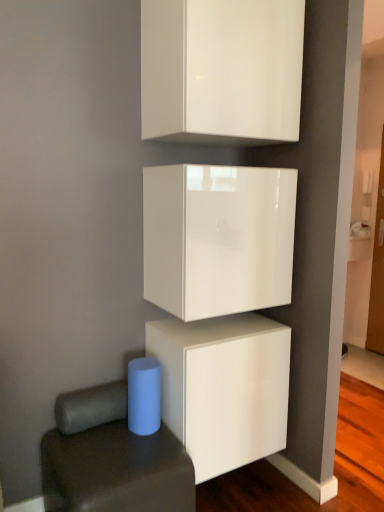
The height and width of the screenshot is (512, 384). Describe the element at coordinates (221, 70) in the screenshot. I see `white glossy cabinet at upper center, which is the first cabinetry in top-to-bottom order` at that location.

What is the approximate width of blue matte cylinder at lower left?

blue matte cylinder at lower left is 22.90 inches wide.

What are the coordinates of `white glossy cabinet at upper center, which is the first cabinetry in top-to-bottom order` in the screenshot? It's located at (221, 70).

Who is smaller, white glossy cabinet at lower center, the third cabinetry in the top-to-bottom sequence, or blue matte cylinder at lower left?

blue matte cylinder at lower left.

Considering the sizes of objects white glossy cabinet at lower center, the 1th cabinetry positioned from the bottom, and blue matte cylinder at lower left in the image provided, who is shorter, white glossy cabinet at lower center, the 1th cabinetry positioned from the bottom, or blue matte cylinder at lower left?

Standing shorter between the two is blue matte cylinder at lower left.

Could you tell me if white glossy cabinet at lower center, the third cabinetry in the top-to-bottom sequence, is turned towards blue matte cylinder at lower left?

No, white glossy cabinet at lower center, the third cabinetry in the top-to-bottom sequence, is not turned towards blue matte cylinder at lower left.

Is white glossy cabinet at lower center, the 1th cabinetry positioned from the bottom, behind blue matte cylinder at lower left?

Yes, the depth of white glossy cabinet at lower center, the 1th cabinetry positioned from the bottom, is greater than that of blue matte cylinder at lower left.

From the image's perspective, is white glossy cabinet at lower center, the 1th cabinetry positioned from the bottom, positioned above or below glossy white cube at center, the second cabinetry from the top?

white glossy cabinet at lower center, the 1th cabinetry positioned from the bottom, is below glossy white cube at center, the second cabinetry from the top.

Which is more to the left, white glossy cabinet at lower center, the third cabinetry in the top-to-bottom sequence, or glossy white cube at center, the second cabinetry when ordered from bottom to top?

Positioned to the left is white glossy cabinet at lower center, the third cabinetry in the top-to-bottom sequence.

Is point (236, 416) less distant than point (226, 251)?

No, (236, 416) is behind (226, 251).

Is there a large distance between white glossy cabinet at lower center, the third cabinetry in the top-to-bottom sequence, and glossy white cube at center, the second cabinetry from the top?

No, white glossy cabinet at lower center, the third cabinetry in the top-to-bottom sequence, is not far away from glossy white cube at center, the second cabinetry from the top.

From the image's perspective, would you say glossy white cube at center, the second cabinetry from the top, is positioned over white glossy cabinet at upper center, which is the first cabinetry in top-to-bottom order?

No, from the image's perspective, glossy white cube at center, the second cabinetry from the top, is not on top of white glossy cabinet at upper center, which is the first cabinetry in top-to-bottom order.

Is glossy white cube at center, the second cabinetry when ordered from bottom to top, positioned behind white glossy cabinet at upper center, the third cabinetry from the bottom?

Yes, glossy white cube at center, the second cabinetry when ordered from bottom to top, is further from the viewer.

From a real-world perspective, between glossy white cube at center, the second cabinetry when ordered from bottom to top, and white glossy cabinet at upper center, the third cabinetry from the bottom, who is vertically higher?

white glossy cabinet at upper center, the third cabinetry from the bottom, is physically above.

How much distance is there between glossy white cube at center, the second cabinetry when ordered from bottom to top, and white glossy cabinet at lower center, the third cabinetry in the top-to-bottom sequence?

glossy white cube at center, the second cabinetry when ordered from bottom to top, and white glossy cabinet at lower center, the third cabinetry in the top-to-bottom sequence, are 16.38 inches apart.

Locate an element on the screen. This screenshot has height=512, width=384. cabinetry lying below the glossy white cube at center, the second cabinetry when ordered from bottom to top (from the image's perspective) is located at coordinates (223, 387).

In terms of width, does glossy white cube at center, the second cabinetry when ordered from bottom to top, look wider or thinner when compared to white glossy cabinet at lower center, the third cabinetry in the top-to-bottom sequence?

Considering their sizes, glossy white cube at center, the second cabinetry when ordered from bottom to top, looks slimmer than white glossy cabinet at lower center, the third cabinetry in the top-to-bottom sequence.

In the scene shown: Is white glossy cabinet at lower center, the 1th cabinetry positioned from the bottom, located within glossy white cube at center, the second cabinetry from the top?

Definitely not — white glossy cabinet at lower center, the 1th cabinetry positioned from the bottom, is not inside glossy white cube at center, the second cabinetry from the top.

In the scene shown: Is glossy white cube at center, the second cabinetry when ordered from bottom to top, positioned far away from blue matte cylinder at lower left?

No.

Which of these two, glossy white cube at center, the second cabinetry from the top, or blue matte cylinder at lower left, is wider?

blue matte cylinder at lower left is wider.

Can you confirm if glossy white cube at center, the second cabinetry from the top, is bigger than blue matte cylinder at lower left?

Yes, glossy white cube at center, the second cabinetry from the top, is bigger than blue matte cylinder at lower left.

Measure the distance between glossy white cube at center, the second cabinetry when ordered from bottom to top, and blue matte cylinder at lower left.

glossy white cube at center, the second cabinetry when ordered from bottom to top, is 29.89 inches away from blue matte cylinder at lower left.

Is white glossy cabinet at lower center, the third cabinetry in the top-to-bottom sequence, inside or outside of white glossy cabinet at upper center, which is the first cabinetry in top-to-bottom order?

The correct answer is: outside.

Between white glossy cabinet at lower center, the third cabinetry in the top-to-bottom sequence, and white glossy cabinet at upper center, which is the first cabinetry in top-to-bottom order, which one has more height?

With more height is white glossy cabinet at upper center, which is the first cabinetry in top-to-bottom order.

Does white glossy cabinet at lower center, the 1th cabinetry positioned from the bottom, turn towards white glossy cabinet at upper center, the third cabinetry from the bottom?

No.

This screenshot has width=384, height=512. Find the location of `cabinetry that is the 2nd object located above the white glossy cabinet at lower center, the 1th cabinetry positioned from the bottom (from the image's perspective)`. cabinetry that is the 2nd object located above the white glossy cabinet at lower center, the 1th cabinetry positioned from the bottom (from the image's perspective) is located at coordinates (221, 70).

From the image's perspective, is blue matte cylinder at lower left on top of glossy white cube at center, the second cabinetry from the top?

Actually, blue matte cylinder at lower left appears below glossy white cube at center, the second cabinetry from the top, in the image.

Could you tell me if blue matte cylinder at lower left is facing glossy white cube at center, the second cabinetry when ordered from bottom to top?

No, blue matte cylinder at lower left is not facing towards glossy white cube at center, the second cabinetry when ordered from bottom to top.

Is point (135, 436) less distant than point (286, 239)?

Yes, it is.

This screenshot has height=512, width=384. In order to click on furniture on the left of white glossy cabinet at lower center, the 1th cabinetry positioned from the bottom in this screenshot , I will do `click(111, 459)`.

Image resolution: width=384 pixels, height=512 pixels. What are the coordinates of `cabinetry that is the 1st object located in front of the white glossy cabinet at lower center, the third cabinetry in the top-to-bottom sequence` in the screenshot? It's located at (218, 238).

Based on their spatial positions, is white glossy cabinet at upper center, which is the first cabinetry in top-to-bottom order, or blue matte cylinder at lower left closer to glossy white cube at center, the second cabinetry when ordered from bottom to top?

Based on the image, white glossy cabinet at upper center, which is the first cabinetry in top-to-bottom order, appears to be nearer to glossy white cube at center, the second cabinetry when ordered from bottom to top.

From the image, which object appears to be farther from blue matte cylinder at lower left, glossy white cube at center, the second cabinetry from the top, or white glossy cabinet at lower center, the third cabinetry in the top-to-bottom sequence?

The object further to blue matte cylinder at lower left is glossy white cube at center, the second cabinetry from the top.

From the image, which object appears to be farther from white glossy cabinet at lower center, the 1th cabinetry positioned from the bottom, glossy white cube at center, the second cabinetry from the top, or white glossy cabinet at upper center, the third cabinetry from the bottom?

The object further to white glossy cabinet at lower center, the 1th cabinetry positioned from the bottom, is white glossy cabinet at upper center, the third cabinetry from the bottom.

Looking at the image, which one is located further to glossy white cube at center, the second cabinetry from the top, white glossy cabinet at upper center, the third cabinetry from the bottom, or white glossy cabinet at lower center, the 1th cabinetry positioned from the bottom?

Result: white glossy cabinet at upper center, the third cabinetry from the bottom, is positioned further to the anchor glossy white cube at center, the second cabinetry from the top.

Considering their positions, is white glossy cabinet at lower center, the 1th cabinetry positioned from the bottom, positioned closer to blue matte cylinder at lower left than glossy white cube at center, the second cabinetry from the top?

The object closer to blue matte cylinder at lower left is white glossy cabinet at lower center, the 1th cabinetry positioned from the bottom.

Which object lies nearer to the anchor point glossy white cube at center, the second cabinetry from the top, blue matte cylinder at lower left or white glossy cabinet at upper center, which is the first cabinetry in top-to-bottom order?

white glossy cabinet at upper center, which is the first cabinetry in top-to-bottom order, is closer to glossy white cube at center, the second cabinetry from the top.

Which object lies further to the anchor point white glossy cabinet at upper center, the third cabinetry from the bottom, white glossy cabinet at lower center, the third cabinetry in the top-to-bottom sequence, or glossy white cube at center, the second cabinetry from the top?

Among the two, white glossy cabinet at lower center, the third cabinetry in the top-to-bottom sequence, is located further to white glossy cabinet at upper center, the third cabinetry from the bottom.

Estimate the real-world distances between objects in this image. Which object is closer to glossy white cube at center, the second cabinetry from the top, white glossy cabinet at lower center, the third cabinetry in the top-to-bottom sequence, or blue matte cylinder at lower left?

white glossy cabinet at lower center, the third cabinetry in the top-to-bottom sequence, lies closer to glossy white cube at center, the second cabinetry from the top, than the other object.

At what (x,y) coordinates should I click in order to perform the action: click on cabinetry between glossy white cube at center, the second cabinetry when ordered from bottom to top, and blue matte cylinder at lower left, in the vertical direction. Please return your answer as a coordinate pair (x, y). Image resolution: width=384 pixels, height=512 pixels. Looking at the image, I should click on (223, 387).

Find the location of a particular element. The height and width of the screenshot is (512, 384). cabinetry between white glossy cabinet at upper center, the third cabinetry from the bottom, and white glossy cabinet at lower center, the 1th cabinetry positioned from the bottom, vertically is located at coordinates (218, 238).